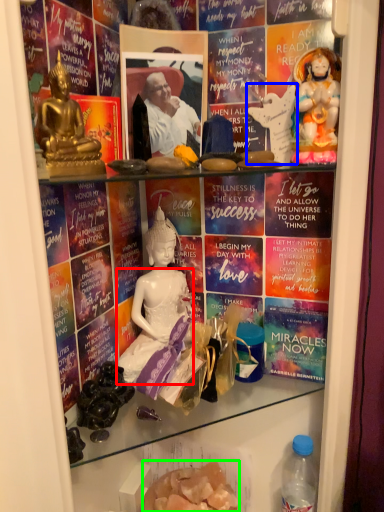
Question: Considering the real-world distances, which object is closest to fancy dress (highlighted by a red box)? sculpture (highlighted by a blue box) or food (highlighted by a green box).

Choices:
 (A) sculpture
 (B) food

Answer: (B)